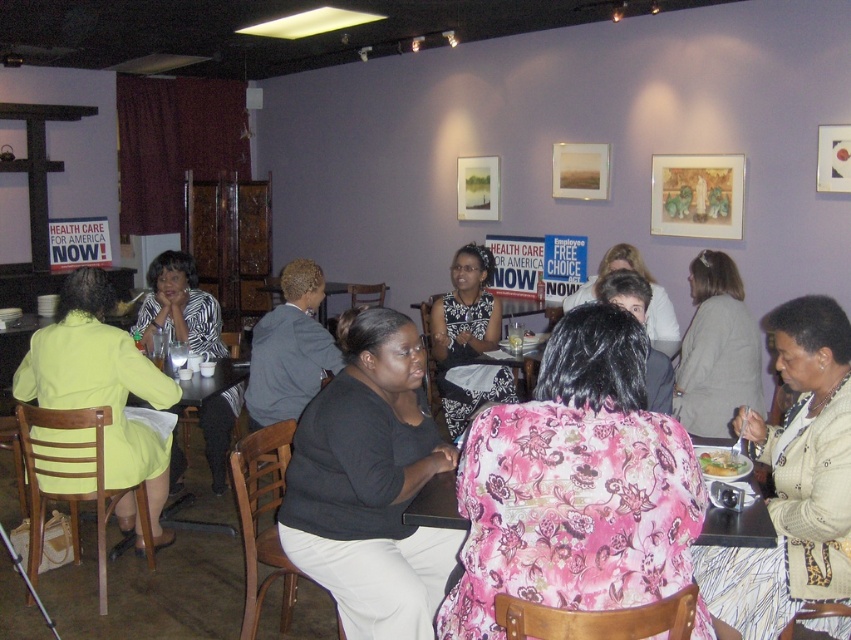
Question: Which of the following is the farthest from the observer?

Choices:
 (A) floral print blouse at center
 (B) floral fabric dress at center

Answer: (A)

Question: Is floral fabric blouse at center to the right of matte yellow blouse at left from the viewer's perspective?

Choices:
 (A) no
 (B) yes

Answer: (B)

Question: Does zebra print blouse at center have a lesser width compared to white paper plate at center?

Choices:
 (A) yes
 (B) no

Answer: (B)

Question: Observing the image, what is the correct spatial positioning of zebra print blouse at center in reference to floral fabric dress at center?

Choices:
 (A) right
 (B) left

Answer: (B)

Question: Which of the following is the farthest from the observer?

Choices:
 (A) 814,522
 (B) 650,275
 (C) 635,301

Answer: (B)

Question: Which of the following is the farthest from the observer?

Choices:
 (A) (629, 253)
 (B) (712, 324)
 (C) (480, 513)
 (D) (729, 461)

Answer: (A)